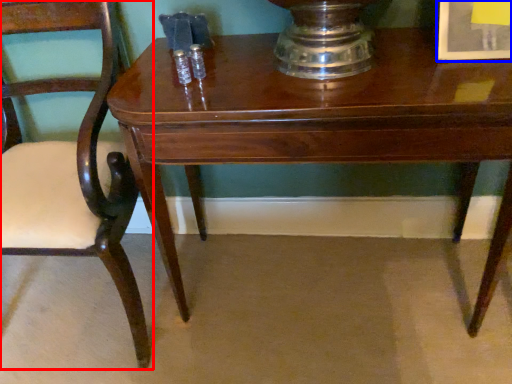
Question: Which point is closer to the camera, chair (highlighted by a red box) or picture frame (highlighted by a blue box)?

Choices:
 (A) chair
 (B) picture frame

Answer: (A)